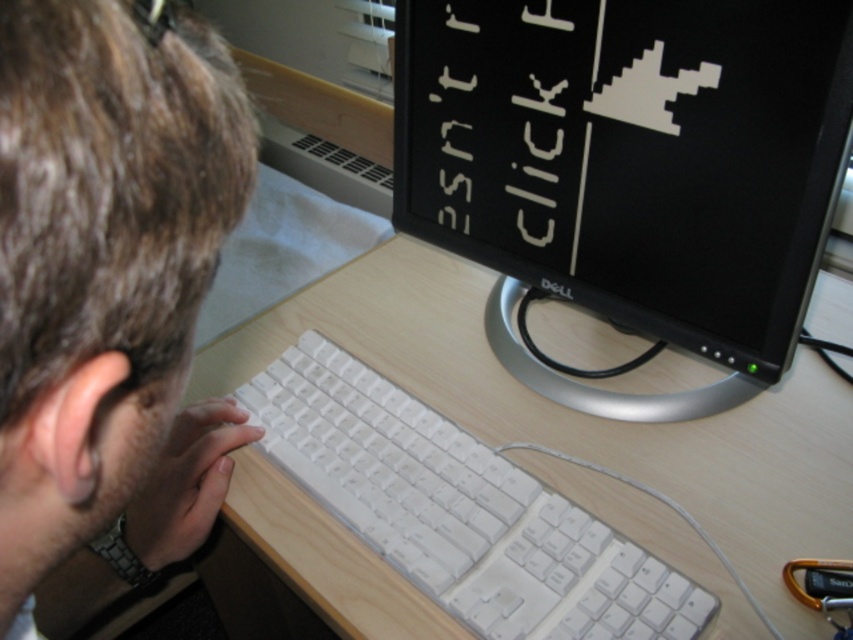
Question: Which is farther from the white plastic keyboard at center?

Choices:
 (A) black glossy monitor at upper center
 (B) light brown hair at upper left

Answer: (A)

Question: Is light brown hair at upper left to the right of white plastic keyboard at center from the viewer's perspective?

Choices:
 (A) no
 (B) yes

Answer: (A)

Question: Does black glossy monitor at upper center appear over light brown hair at upper left?

Choices:
 (A) no
 (B) yes

Answer: (B)

Question: Where is light brown hair at upper left located in relation to white plastic keyboard at center in the image?

Choices:
 (A) right
 (B) left

Answer: (B)

Question: Which point appears closest to the camera in this image?

Choices:
 (A) (784, 42)
 (B) (96, 474)

Answer: (B)

Question: Which point appears closest to the camera in this image?

Choices:
 (A) (392, 417)
 (B) (19, 56)

Answer: (B)